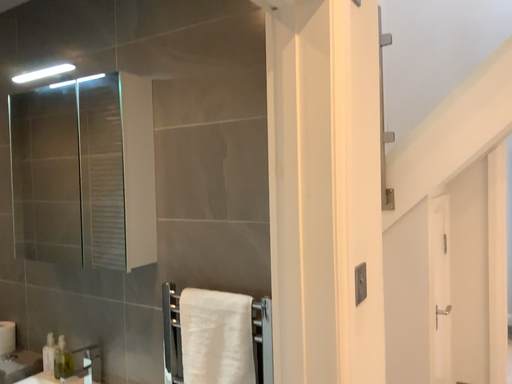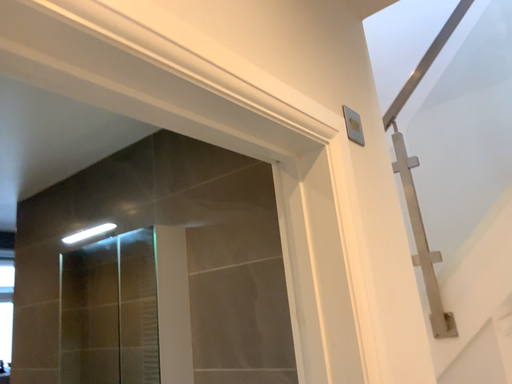
Question: Which way did the camera rotate in the video?

Choices:
 (A) rotated left
 (B) rotated right

Answer: (A)